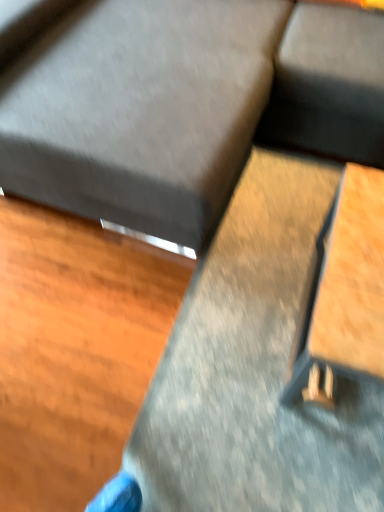
You are a GUI agent. You are given a task and a screenshot of the screen. Output one action in this format:
    pyautogui.click(x=<x>, y=<y>)
    Task: Click on the free point to the left of textured gray concrete at center
    The height and width of the screenshot is (512, 384).
    Given the screenshot: What is the action you would take?
    pyautogui.click(x=90, y=321)